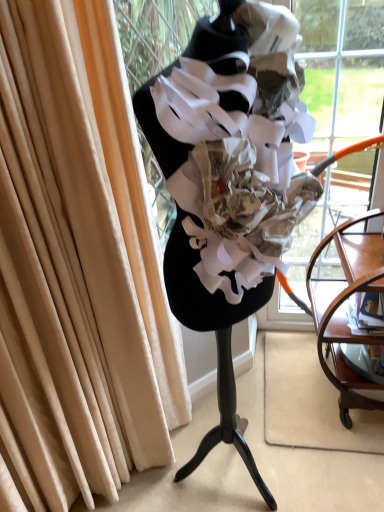
Question: Are beige velvet curtain at left and transparent glass shop window at center far apart?

Choices:
 (A) no
 (B) yes

Answer: (A)

Question: From a real-world perspective, is beige velvet curtain at left over transparent glass shop window at center?

Choices:
 (A) yes
 (B) no

Answer: (A)

Question: Is beige velvet curtain at left looking in the opposite direction of transparent glass shop window at center?

Choices:
 (A) yes
 (B) no

Answer: (B)

Question: From the image's perspective, is beige velvet curtain at left over transparent glass shop window at center?

Choices:
 (A) no
 (B) yes

Answer: (B)

Question: Is beige velvet curtain at left directly adjacent to transparent glass shop window at center?

Choices:
 (A) yes
 (B) no

Answer: (B)

Question: From a real-world perspective, is clear glass shelf at lower right physically located above or below beige velvet curtain at left?

Choices:
 (A) above
 (B) below

Answer: (B)

Question: Choose the correct answer: Is clear glass shelf at lower right inside beige velvet curtain at left or outside it?

Choices:
 (A) outside
 (B) inside

Answer: (A)

Question: Considering the positions of clear glass shelf at lower right and beige velvet curtain at left in the image, is clear glass shelf at lower right taller or shorter than beige velvet curtain at left?

Choices:
 (A) short
 (B) tall

Answer: (A)

Question: Would you say clear glass shelf at lower right is to the left or to the right of beige velvet curtain at left in the picture?

Choices:
 (A) right
 (B) left

Answer: (A)

Question: Considering the relative positions of mahogany wood side table at right and transparent glass shop window at center in the image provided, is mahogany wood side table at right to the left or to the right of transparent glass shop window at center?

Choices:
 (A) right
 (B) left

Answer: (A)

Question: Is mahogany wood side table at right taller or shorter than transparent glass shop window at center?

Choices:
 (A) short
 (B) tall

Answer: (A)

Question: Is point (342, 378) closer or farther from the camera than point (140, 54)?

Choices:
 (A) farther
 (B) closer

Answer: (B)

Question: Considering the positions of mahogany wood side table at right and transparent glass shop window at center in the image, is mahogany wood side table at right bigger or smaller than transparent glass shop window at center?

Choices:
 (A) small
 (B) big

Answer: (A)

Question: Would you say clear glass shelf at lower right is inside or outside mahogany wood side table at right?

Choices:
 (A) inside
 (B) outside

Answer: (A)

Question: Is clear glass shelf at lower right wider or thinner than mahogany wood side table at right?

Choices:
 (A) wide
 (B) thin

Answer: (B)